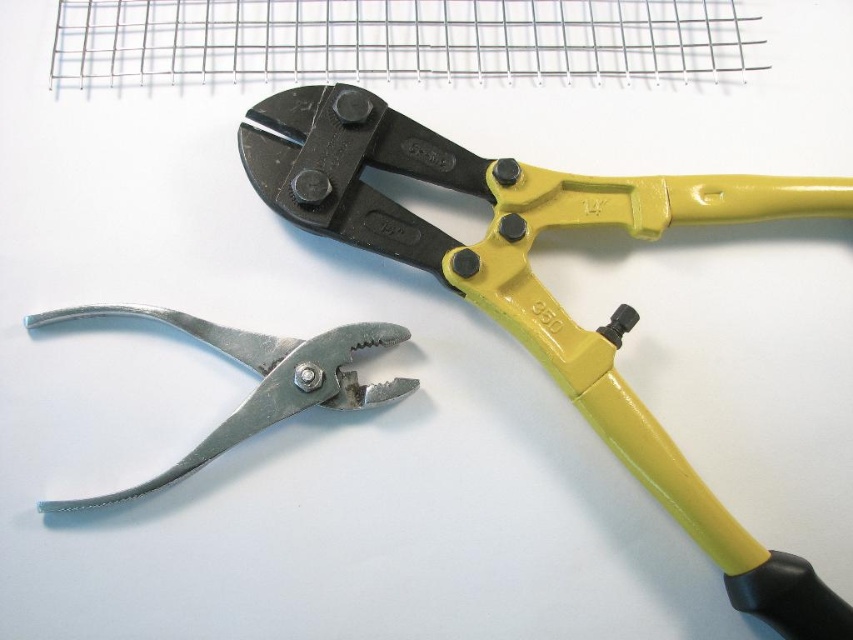
Question: Which point appears farthest from the camera in this image?

Choices:
 (A) (270, 109)
 (B) (183, 474)

Answer: (A)

Question: Is the position of yellow matte/black textured bolt cutter at upper right more distant than that of metallic silver pliers at lower left?

Choices:
 (A) yes
 (B) no

Answer: (B)

Question: Is yellow matte/black textured bolt cutter at upper right to the left of metallic silver pliers at lower left from the viewer's perspective?

Choices:
 (A) yes
 (B) no

Answer: (B)

Question: Can you confirm if yellow matte/black textured bolt cutter at upper right is bigger than metallic silver pliers at lower left?

Choices:
 (A) no
 (B) yes

Answer: (B)